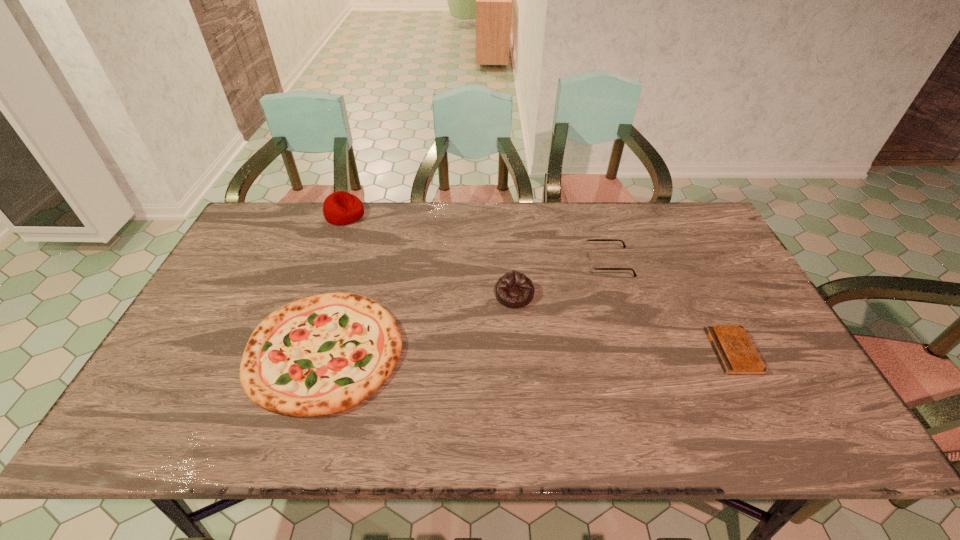
You are a GUI agent. You are given a task and a screenshot of the screen. Output one action in this format:
    pyautogui.click(x=<x>, y=<y>)
    Task: Click on the vacant region located on the left of the nearer beanbag
    The width and height of the screenshot is (960, 540).
    Given the screenshot: What is the action you would take?
    pyautogui.click(x=453, y=295)

The height and width of the screenshot is (540, 960). What are the coordinates of `free space located 0.350m at the hinge ends of the second object from right to left` in the screenshot? It's located at (472, 264).

The width and height of the screenshot is (960, 540). What are the coordinates of `free space located 0.230m at the hinge ends of the second object from right to left` in the screenshot? It's located at (511, 264).

In order to click on vacant space located at the hinge ends of the second object from right to left in this screenshot , I will do `click(489, 264)`.

Identify the location of vacant space situated 0.090m on the back of the pizza. The height and width of the screenshot is (540, 960). (348, 276).

At what (x,y) coordinates should I click in order to perform the action: click on vacant space situated 0.120m on the spine side of the shortest object. Please return your answer as a coordinate pair (x, y). The height and width of the screenshot is (540, 960). Looking at the image, I should click on (666, 351).

Locate an element on the screen. The width and height of the screenshot is (960, 540). vacant space located 0.050m on the spine side of the shortest object is located at coordinates (694, 351).

Identify the location of blank area located 0.310m on the spine side of the shortest object. (592, 351).

Identify the location of object positioned at the far edge. This screenshot has width=960, height=540. (340, 208).

Where is `object located in the near edge section of the desktop`? The height and width of the screenshot is (540, 960). object located in the near edge section of the desktop is located at coordinates (320, 355).